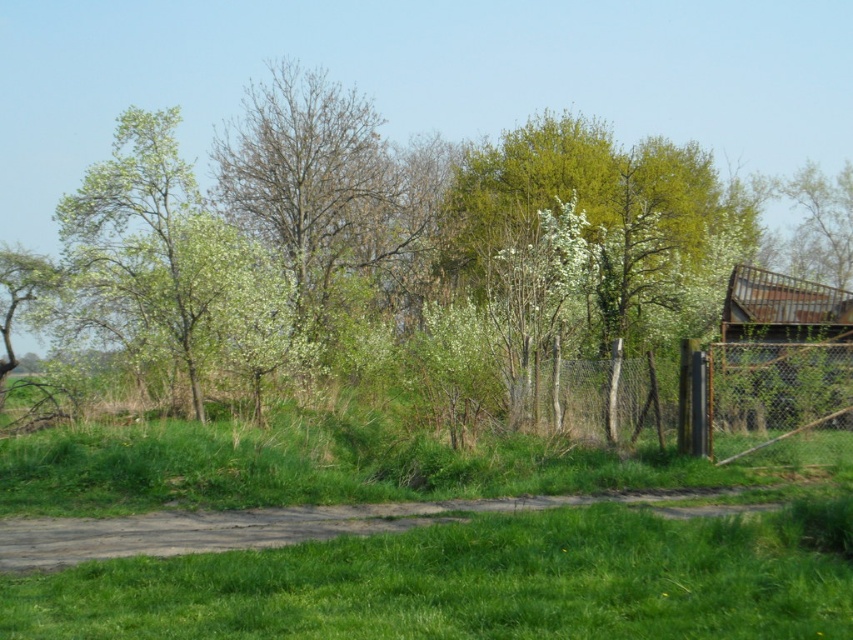
You are standing in the rural spring scene described. There is a point marked at coordinates [422,230]. What object is located at that point?

The point at coordinates [422,230] is occupied by the green leafy tree at center.